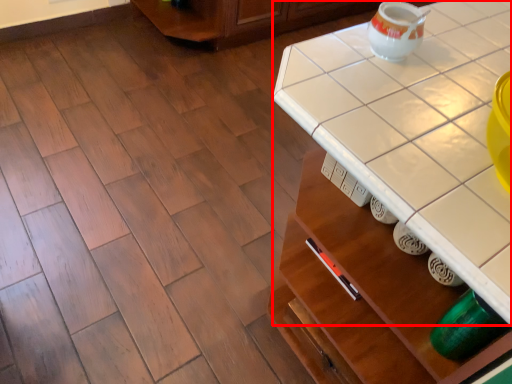
Question: From the image's perspective, what is the correct spatial relationship of counter top (annotated by the red box) in relation to tea pot?

Choices:
 (A) below
 (B) above

Answer: (A)